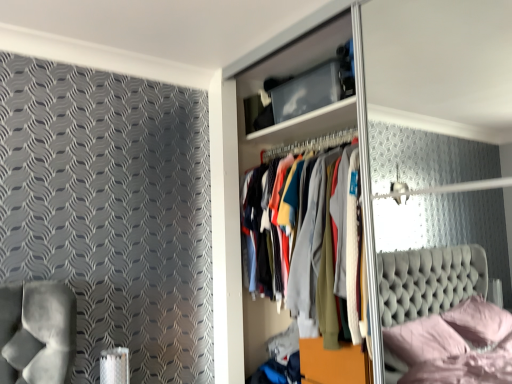
Question: Is transparent plastic glass door at center with wooden dresser at center?

Choices:
 (A) no
 (B) yes

Answer: (A)

Question: Considering the relative sizes of transparent plastic glass door at center and wooden dresser at center in the image provided, is transparent plastic glass door at center thinner than wooden dresser at center?

Choices:
 (A) no
 (B) yes

Answer: (A)

Question: Does transparent plastic glass door at center appear on the left side of wooden dresser at center?

Choices:
 (A) no
 (B) yes

Answer: (A)

Question: From the image's perspective, would you say transparent plastic glass door at center is positioned over wooden dresser at center?

Choices:
 (A) yes
 (B) no

Answer: (B)

Question: Is wooden dresser at center at the back of transparent plastic glass door at center?

Choices:
 (A) yes
 (B) no

Answer: (A)

Question: Is transparent plastic glass door at center at the right side of wooden dresser at center?

Choices:
 (A) yes
 (B) no

Answer: (A)

Question: Is wooden dresser at center behind transparent plastic glass door at center?

Choices:
 (A) yes
 (B) no

Answer: (A)

Question: Is wooden dresser at center to the left of transparent plastic glass door at center from the viewer's perspective?

Choices:
 (A) no
 (B) yes

Answer: (B)

Question: From the image's perspective, is wooden dresser at center above transparent plastic glass door at center?

Choices:
 (A) yes
 (B) no

Answer: (A)

Question: Is wooden dresser at center positioned far away from transparent plastic glass door at center?

Choices:
 (A) no
 (B) yes

Answer: (A)

Question: Does wooden dresser at center lie in front of transparent plastic glass door at center?

Choices:
 (A) no
 (B) yes

Answer: (A)

Question: Is wooden dresser at center smaller than transparent plastic glass door at center?

Choices:
 (A) yes
 (B) no

Answer: (A)

Question: Is point (382, 38) closer or farther from the camera than point (323, 14)?

Choices:
 (A) closer
 (B) farther

Answer: (B)